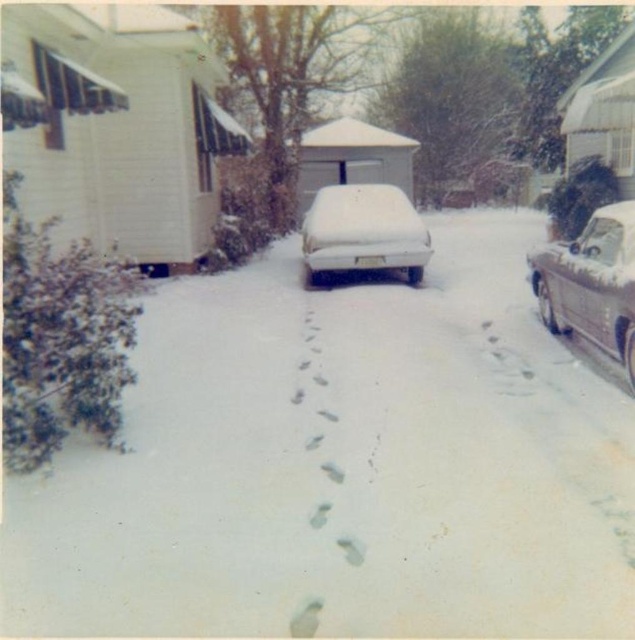
Question: Can you confirm if white snow-covered driveway at center is thinner than silver metallic car at right?

Choices:
 (A) yes
 (B) no

Answer: (B)

Question: Does white snow-covered driveway at center have a lesser width compared to white matte car at center?

Choices:
 (A) yes
 (B) no

Answer: (B)

Question: Is silver metallic car at right thinner than white matte car at center?

Choices:
 (A) no
 (B) yes

Answer: (A)

Question: Among these points, which one is nearest to the camera?

Choices:
 (A) (622, 211)
 (B) (349, 195)
 (C) (398, 560)

Answer: (C)

Question: Based on their relative distances, which object is farther from the white snow-covered driveway at center?

Choices:
 (A) white matte car at center
 (B) silver metallic car at right

Answer: (A)

Question: Which of these objects is positioned farthest from the silver metallic car at right?

Choices:
 (A) white snow-covered driveway at center
 (B) white matte car at center

Answer: (B)